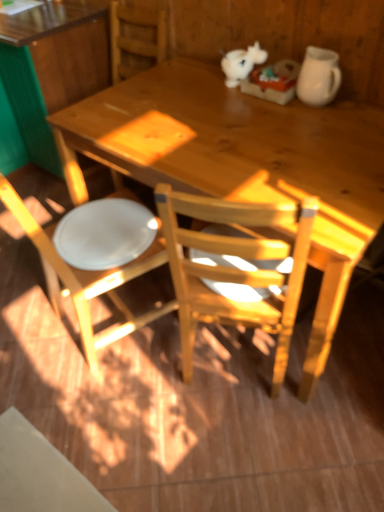
Question: From the image's perspective, is wooden desk at upper left, placed as the 1th desk when sorted from left to right, located above white matte chair at left?

Choices:
 (A) yes
 (B) no

Answer: (A)

Question: Is wooden desk at upper left, placed as the 1th desk when sorted from left to right, positioned far away from white matte chair at left?

Choices:
 (A) yes
 (B) no

Answer: (B)

Question: Is wooden desk at upper left, which is the second desk in right-to-left order, closer to the viewer compared to white matte chair at left?

Choices:
 (A) no
 (B) yes

Answer: (A)

Question: Can you confirm if wooden desk at upper left, placed as the 1th desk when sorted from left to right, is positioned to the right of white matte chair at left?

Choices:
 (A) no
 (B) yes

Answer: (A)

Question: From the image's perspective, is wooden desk at upper left, placed as the 1th desk when sorted from left to right, beneath white matte chair at left?

Choices:
 (A) yes
 (B) no

Answer: (B)

Question: Considering the positions of white matte unicorn at upper center and white glossy plate at lower left in the image, is white matte unicorn at upper center taller or shorter than white glossy plate at lower left?

Choices:
 (A) short
 (B) tall

Answer: (B)

Question: From the image's perspective, relative to white glossy plate at lower left, is white matte unicorn at upper center above or below?

Choices:
 (A) below
 (B) above

Answer: (B)

Question: Do you think white matte unicorn at upper center is within white glossy plate at lower left, or outside of it?

Choices:
 (A) outside
 (B) inside

Answer: (A)

Question: Considering their positions, is white matte unicorn at upper center located in front of or behind white glossy plate at lower left?

Choices:
 (A) front
 (B) behind

Answer: (B)

Question: Considering the positions of wooden desk at center, marked as the first desk in a right-to-left arrangement, and white matte chair at left in the image, is wooden desk at center, marked as the first desk in a right-to-left arrangement, taller or shorter than white matte chair at left?

Choices:
 (A) short
 (B) tall

Answer: (A)

Question: From a real-world perspective, is wooden desk at center, which is the second desk from left to right, above or below white matte chair at left?

Choices:
 (A) above
 (B) below

Answer: (B)

Question: In the image, is wooden desk at center, marked as the first desk in a right-to-left arrangement, positioned in front of or behind white matte chair at left?

Choices:
 (A) behind
 (B) front

Answer: (B)

Question: Based on their sizes in the image, would you say wooden desk at center, marked as the first desk in a right-to-left arrangement, is bigger or smaller than white matte chair at left?

Choices:
 (A) small
 (B) big

Answer: (B)

Question: In the image, is white matte chair at left positioned in front of or behind wooden desk at upper left, placed as the 1th desk when sorted from left to right?

Choices:
 (A) front
 (B) behind

Answer: (A)

Question: In terms of width, does white matte chair at left look wider or thinner when compared to wooden desk at upper left, which is the second desk in right-to-left order?

Choices:
 (A) thin
 (B) wide

Answer: (A)